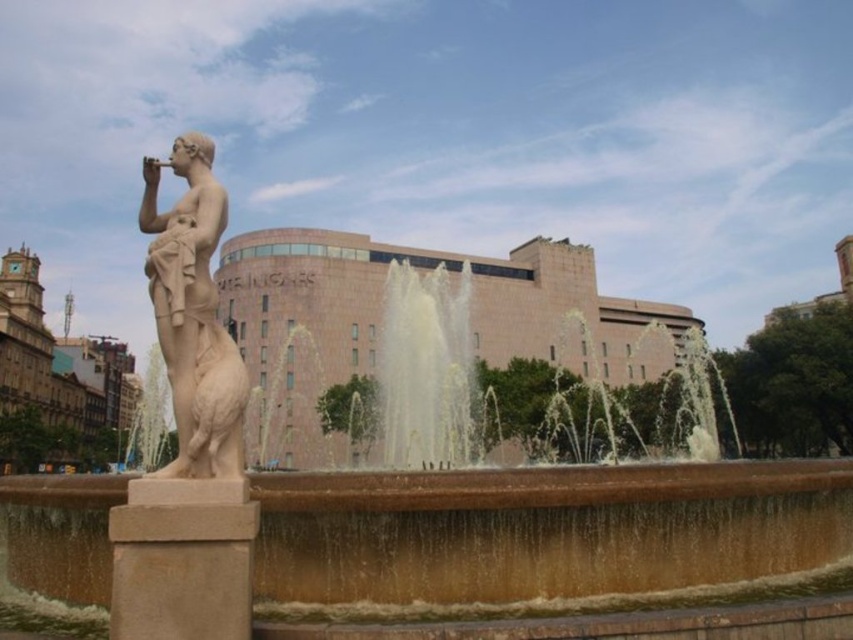
You are standing in front of the brown stone fountain at center and want to take a photo of the white marble statue at left. Which direction should you move to get the statue in your camera frame?

The brown stone fountain at center is positioned on the left side of the white marble statue at left, so you should move to the right to get the statue in your camera frame.

You are planning to place a small bench next to the brown stone fountain at center and the white marble statue at left. Since you want the bench to be near the fountain but still visible from the statue, which side of the fountain should you place it on?

The bench should be placed on the side of the brown stone fountain at center that is closer to the white marble statue at left. This ensures it is near the fountain while remaining visible from the statue.